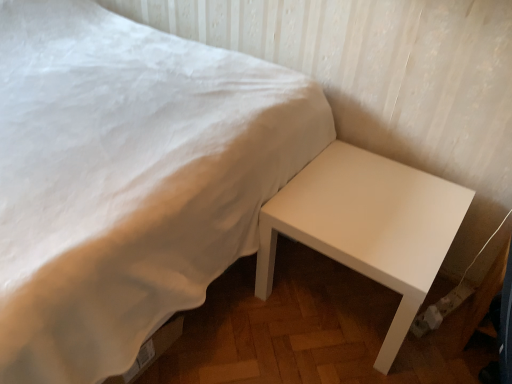
Identify the location of vacant region above white glossy table at lower right (from a real-world perspective). The height and width of the screenshot is (384, 512). (374, 208).